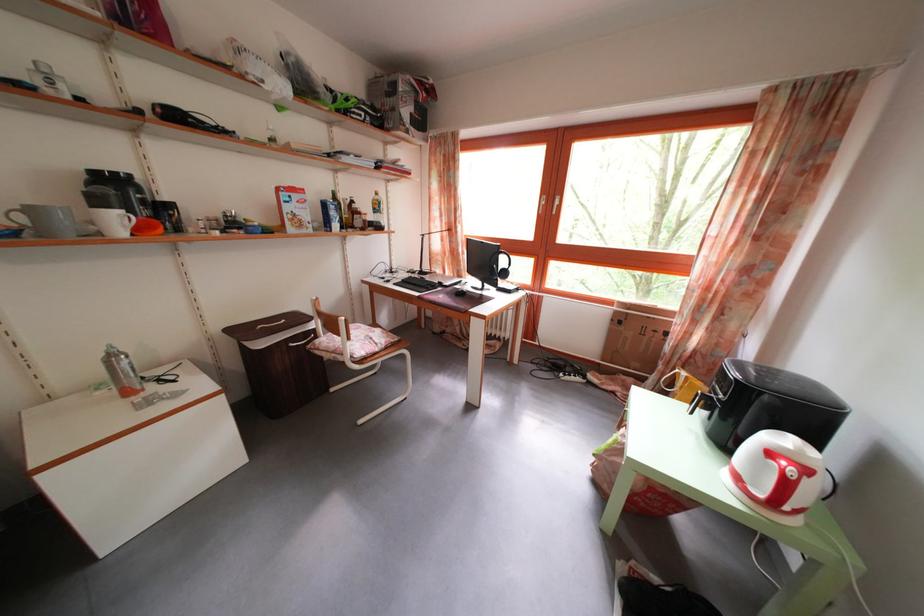
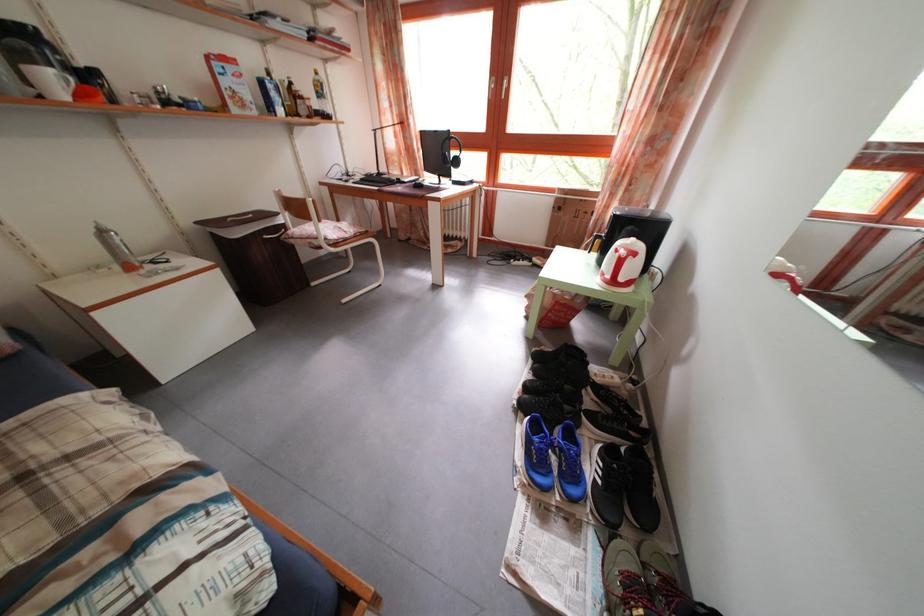
Locate, in the second image, the point that corresponds to [492,265] in the first image.

(446, 160)